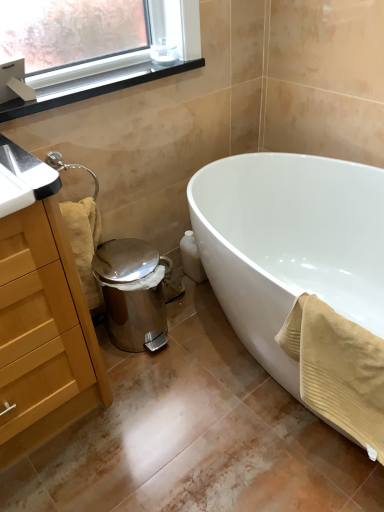
Identify the location of vacant area that lies to the right of wooden cabinet at left. (147, 415).